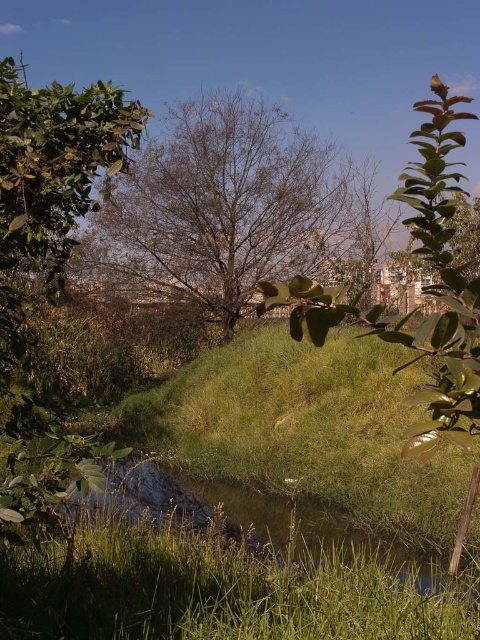
Question: Which point is farther to the camera?

Choices:
 (A) (465, 118)
 (B) (165, 154)
 (C) (48, 474)

Answer: (B)

Question: Is bare branches tree at center bigger than green leafy tree at center?

Choices:
 (A) yes
 (B) no

Answer: (B)

Question: Is bare branches tree at center to the left of green leafy tree at left from the viewer's perspective?

Choices:
 (A) no
 (B) yes

Answer: (A)

Question: Does bare branches tree at center appear on the right side of green leafy tree at left?

Choices:
 (A) no
 (B) yes

Answer: (B)

Question: Which of the following is the farthest from the observer?

Choices:
 (A) bare branches tree at center
 (B) green leafy tree at center
 (C) green leafy tree at left

Answer: (A)

Question: Among these objects, which one is nearest to the camera?

Choices:
 (A) green leafy tree at left
 (B) bare branches tree at center

Answer: (A)